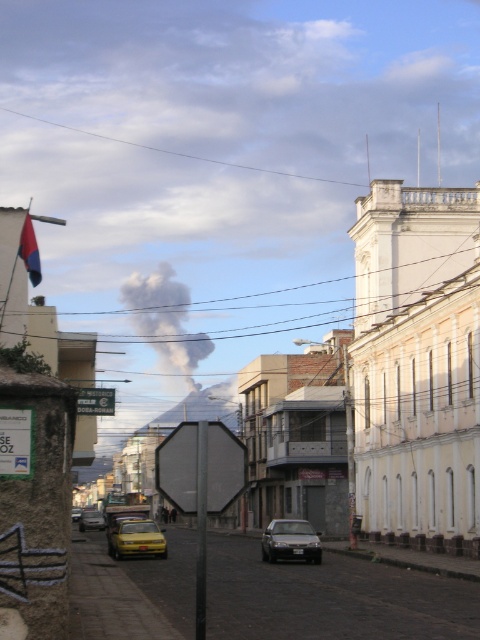
Is silver metallic sedan at center below yellow matte taxi at center?

Yes.

What do you see at coordinates (290, 541) in the screenshot? This screenshot has width=480, height=640. I see `silver metallic sedan at center` at bounding box center [290, 541].

Is point (279, 529) positioned before point (143, 554)?

No, (279, 529) is further to viewer.

Find the location of `silver metallic sedan at center`. silver metallic sedan at center is located at coordinates (290, 541).

Is metallic yellow car at center to the left of silver metallic sedan at center from the viewer's perspective?

Yes, metallic yellow car at center is to the left of silver metallic sedan at center.

Who is shorter, metallic yellow car at center or silver metallic sedan at center?

With less height is silver metallic sedan at center.

Is point (153, 595) farther from camera compared to point (307, 534)?

No, it is not.

This screenshot has width=480, height=640. What are the coordinates of `metallic yellow car at center` in the screenshot? It's located at (330, 598).

Which of these two, gray smoke at center or silver metallic sedan at center, stands taller?

gray smoke at center

Who is positioned more to the right, gray smoke at center or silver metallic sedan at center?

silver metallic sedan at center is more to the right.

Between point (146, 326) and point (268, 534), which one is positioned in front?

Point (268, 534) is more forward.

Locate an element on the screen. This screenshot has height=640, width=480. gray smoke at center is located at coordinates (165, 317).